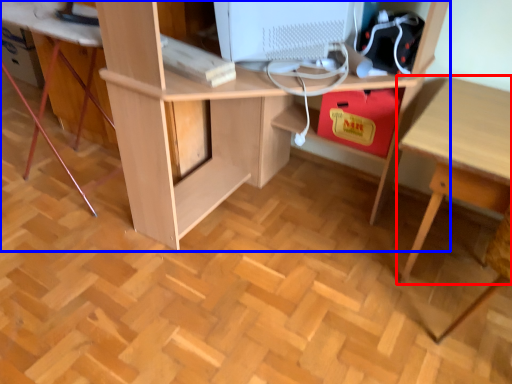
Question: Which point is further to the camera, table (highlighted by a red box) or desk (highlighted by a blue box)?

Choices:
 (A) table
 (B) desk

Answer: (A)